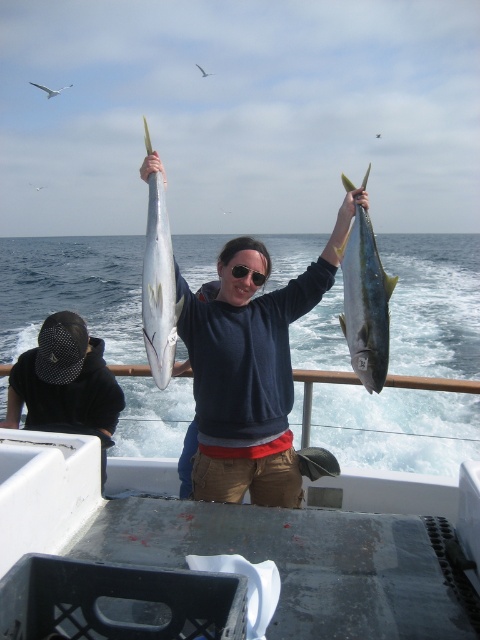
Does black fabric cap at lower left have a greater height compared to yellowish-green shiny fish at upper center?

Yes, black fabric cap at lower left is taller than yellowish-green shiny fish at upper center.

Does black fabric cap at lower left appear on the right side of yellowish-green shiny fish at upper center?

In fact, black fabric cap at lower left is to the left of yellowish-green shiny fish at upper center.

This screenshot has height=640, width=480. I want to click on black fabric cap at lower left, so click(66, 385).

The height and width of the screenshot is (640, 480). I want to click on black fabric cap at lower left, so click(66, 385).

Does shiny silver fish at upper center have a smaller size compared to black plastic sunglasses at upper center?

Incorrect, shiny silver fish at upper center is not smaller in size than black plastic sunglasses at upper center.

How far apart are shiny silver fish at upper center and black plastic sunglasses at upper center?

The distance of shiny silver fish at upper center from black plastic sunglasses at upper center is 20.51 inches.

Who is more forward, (x=144, y=282) or (x=249, y=262)?

Positioned in front is point (x=144, y=282).

The image size is (480, 640). What are the coordinates of `shiny silver fish at upper center` in the screenshot? It's located at (158, 288).

Which is above, matte yellow fish at center or black plastic sunglasses at upper center?

Positioned higher is black plastic sunglasses at upper center.

Is matte yellow fish at center taller than black plastic sunglasses at upper center?

Correct, matte yellow fish at center is much taller as black plastic sunglasses at upper center.

Which is behind, point (253, 424) or point (253, 276)?

The point (253, 276) is more distant.

Identify the location of matte yellow fish at center. (251, 378).